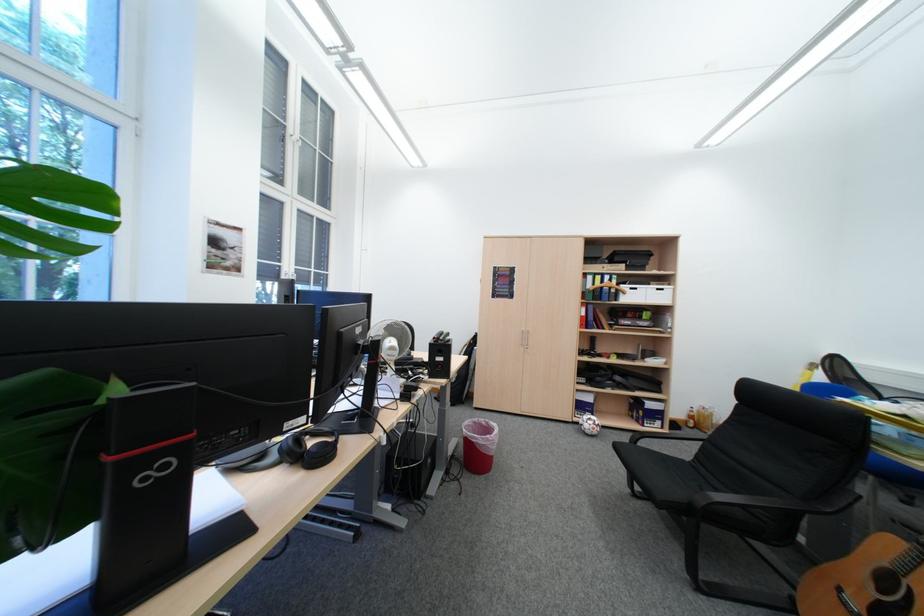
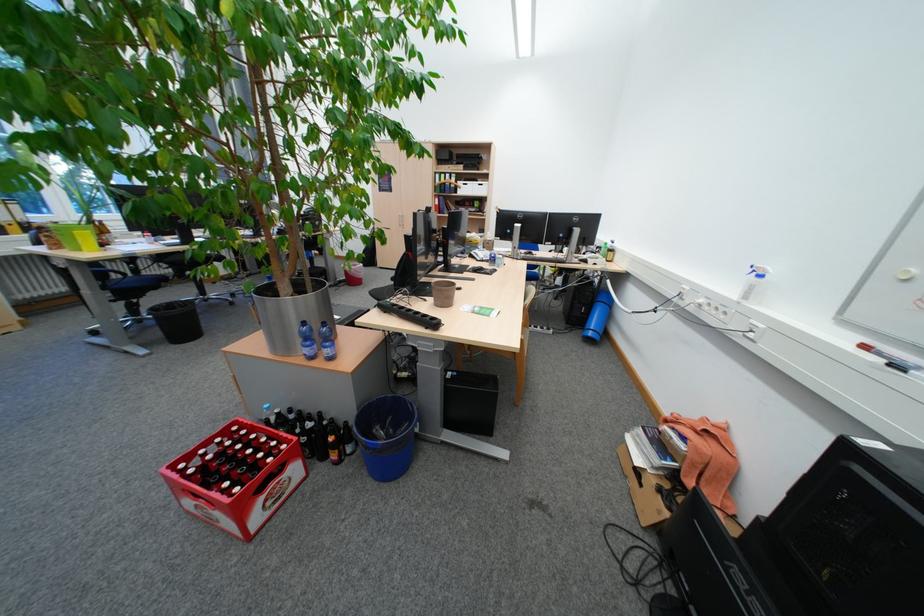
The images are taken continuously from a first-person perspective. In which direction are you moving?

The cameraman walked toward right, backward.